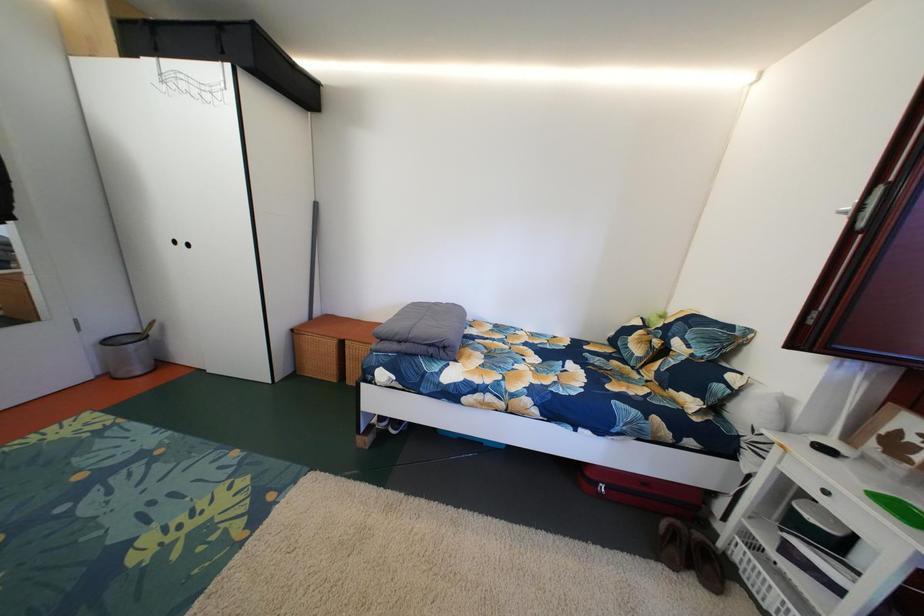
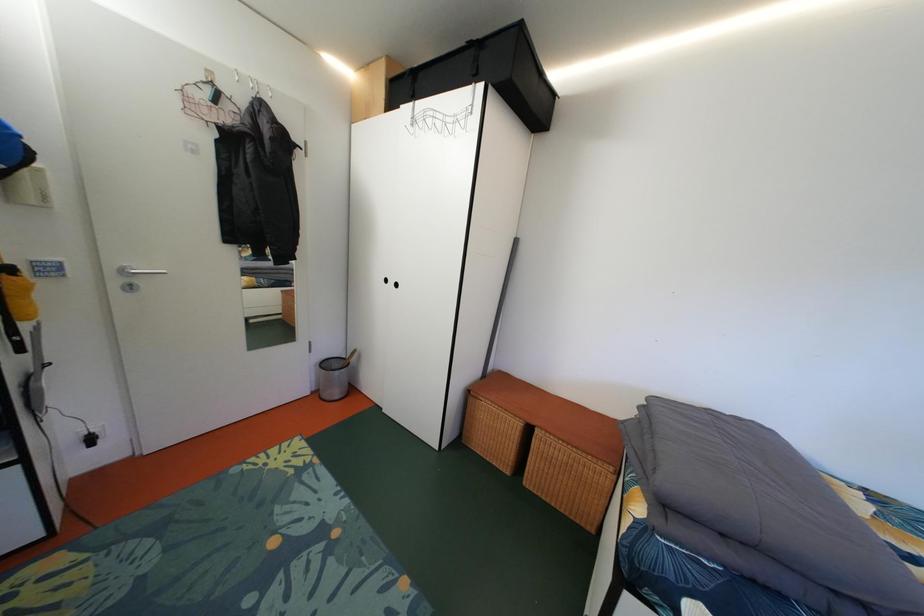
What movement of the cameraman would produce the second image?

The cameraman walked toward left, forward.